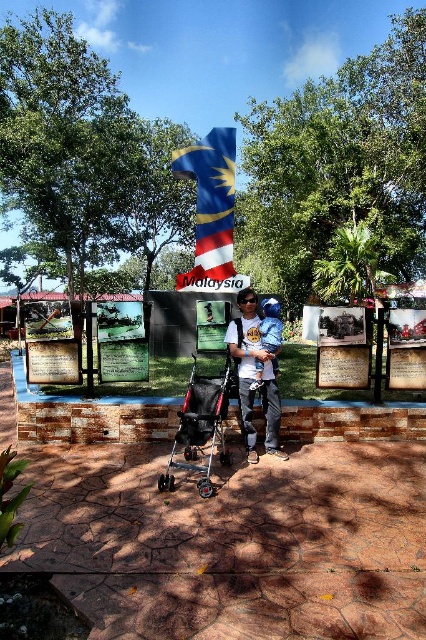
You are standing at the point marked by the coordinates point (201, 426) in the image. What object is located exactly at this point?

The point (201, 426) indicates the location of the black plastic baby carriage at center.

You are standing at the entrance of the historical site and want to take a photo of the malaysian flag at center. If you are facing the flag, which direction should you walk to get closer to it?

Since the malaysian flag at center is located at point (210,204), you should walk forward towards the center of the scene to get closer to it.

You are a photographer planning to take a photo of the Malaysian flag structure and the black plastic baby carriage at center. If you want to ensure both are in the frame, where should you position the baby carriage relative to the flag structure?

The black plastic baby carriage at center is located at point (201, 426) in the image, so positioning it near the center of the frame would ensure both the flag structure and the carriage are included in the photo.